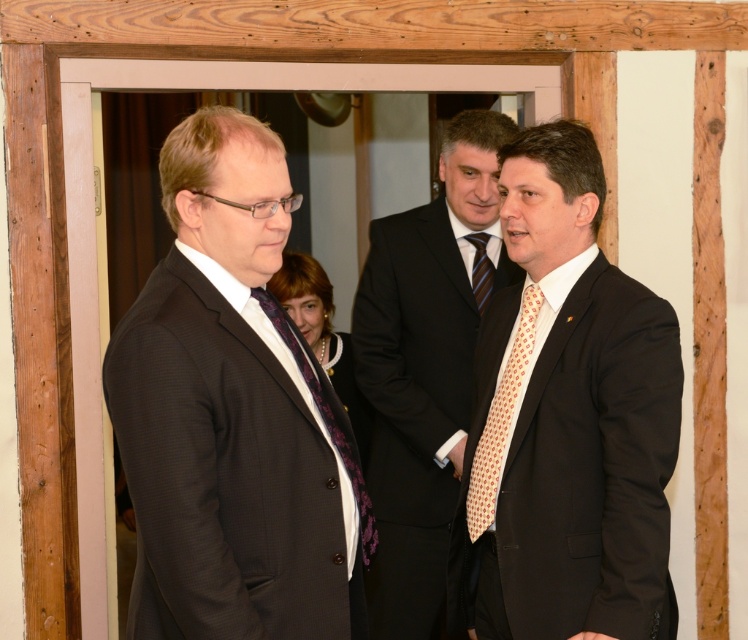
Consider the image. You are a photographer at a formal event. You need to capture a closeup of the polka dot tie at center and the purple textured tie at center. Which tie will appear larger in the photo?

The polka dot tie at center will appear larger in the photo because it is bigger than the purple textured tie at center.

You are a photographer who needs to capture a group photo of the matte black suit at left and the light orange dotted tie at right. The camera you are using has a minimum focusing distance of 60 centimeters. Will you be able to take a clear photo of both subjects without moving either of them?

The matte black suit at left and light orange dotted tie at right are 59.88 centimeters apart from each other. Since the distance between them is less than the camera minimum focusing distance of 60 centimeters, the camera may not be able to focus properly on both subjects simultaneously, resulting in a blurry image. Therefore, it is recommended to move the subjects slightly further apart or use a different camera with a shorter minimum focusing distance.

You are a photographer preparing to take a group photo of the men in front of the doorway. The camera has a focus range of 20 inches. Will both the polka dot tie at center and the purple textured tie at center be in focus?

The polka dot tie at center is 19.97 inches from the purple textured tie at center, which is within the camera focus range of 20 inches. Therefore, both ties will be in focus.